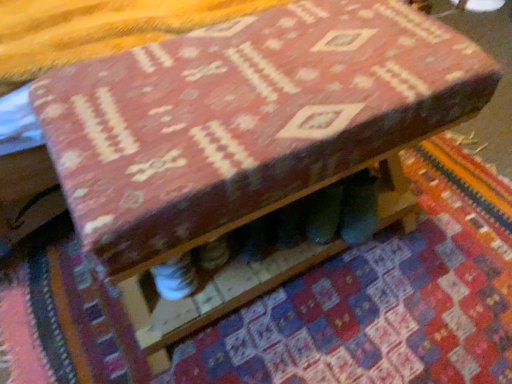
Find the location of a particular element. The image size is (512, 384). vacant region under textured woolen mat at center (from a real-world perspective) is located at coordinates (387, 271).